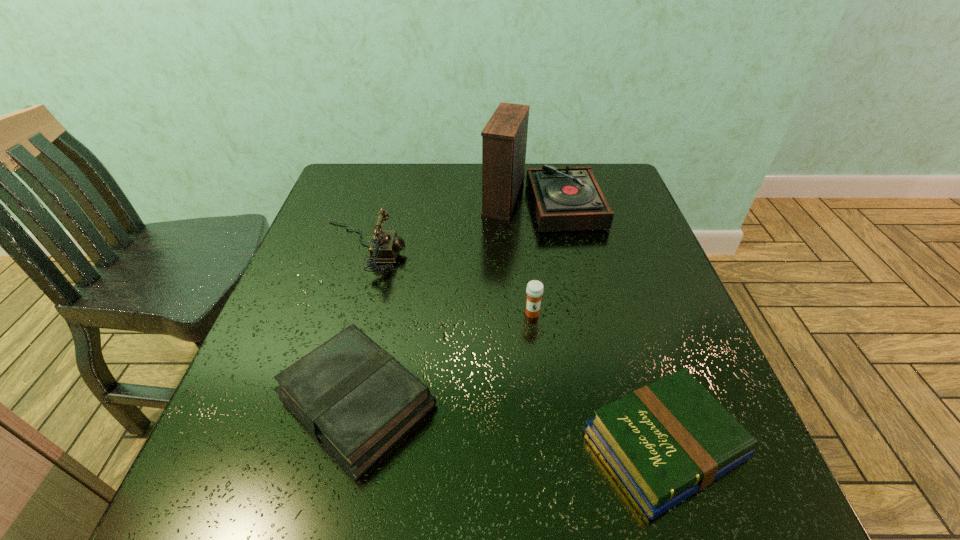
I want to click on free point at the near edge, so click(x=369, y=518).

I want to click on vacant point at the left edge, so click(x=283, y=368).

Locate an element on the screen. This screenshot has width=960, height=540. vacant region at the right edge of the desktop is located at coordinates (630, 230).

Locate an element on the screen. This screenshot has height=540, width=960. blank space at the far left corner is located at coordinates (354, 205).

I want to click on free space at the far right corner of the desktop, so click(x=619, y=166).

This screenshot has height=540, width=960. In the image, there is a desktop. In order to click on free space at the near right corner in this screenshot , I will do `click(749, 482)`.

Find the location of `free spot between the phonograph record and the right book`. free spot between the phonograph record and the right book is located at coordinates (602, 322).

In order to click on free space between the telephone and the left book in this screenshot , I will do `click(360, 324)`.

You are a GUI agent. You are given a task and a screenshot of the screen. Output one action in this format:
    pyautogui.click(x=<x>, y=<y>)
    Task: Click on the free space between the second tallest object and the tallest object
    
    Given the screenshot: What is the action you would take?
    pyautogui.click(x=451, y=224)

The image size is (960, 540). Identify the location of vacant space in between the telephone and the third shortest object. (447, 280).